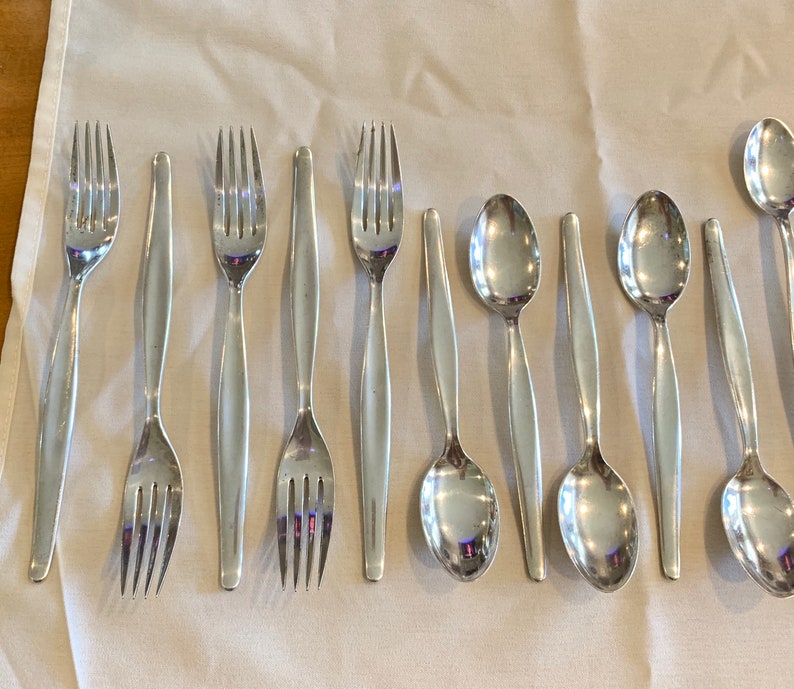
The width and height of the screenshot is (794, 689). I want to click on fork, so click(85, 257), click(149, 437), click(241, 276), click(375, 311), click(314, 307).